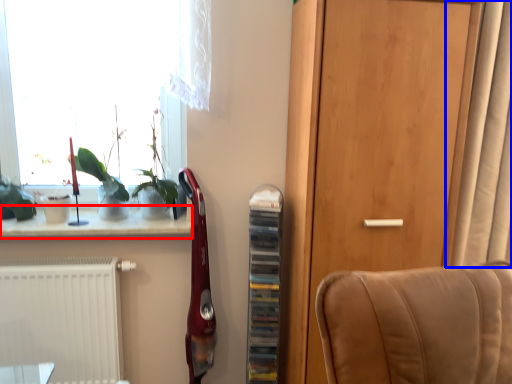
Question: Which object appears farthest to the camera in this image, window sill (highlighted by a red box) or curtain (highlighted by a blue box)?

Choices:
 (A) window sill
 (B) curtain

Answer: (A)